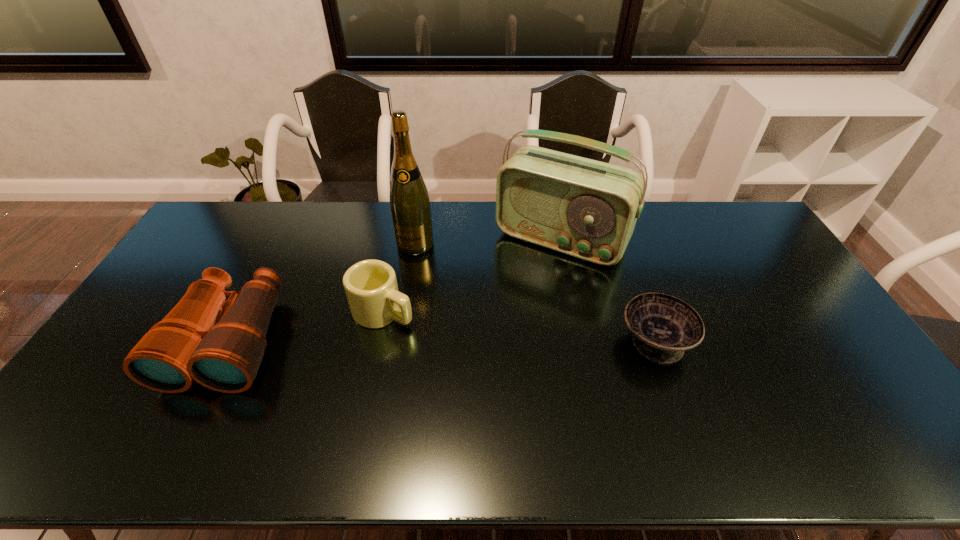
At what (x,y) coordinates should I click in order to perform the action: click on free space that is in between the mug and the wine bottle. Please return your answer as a coordinate pair (x, y). This screenshot has height=540, width=960. Looking at the image, I should click on (399, 278).

Identify the location of empty space between the tallest object and the bowl. (535, 293).

Where is `object that stands as the fourth closest to the radio receiver`? object that stands as the fourth closest to the radio receiver is located at coordinates (224, 354).

Find the location of a particular element. object that stands as the second closest to the mug is located at coordinates (410, 206).

At what (x,y) coordinates should I click in order to perform the action: click on free space that satisfies the following two spatial constraints: 1. through the lenses of the leftmost object; 2. on the right side of the bowl. Please return your answer as a coordinate pair (x, y). The width and height of the screenshot is (960, 540). Looking at the image, I should click on (229, 341).

Where is `vacant space that satisfies the following two spatial constraints: 1. through the lenses of the binoculars; 2. on the left side of the bowl`? vacant space that satisfies the following two spatial constraints: 1. through the lenses of the binoculars; 2. on the left side of the bowl is located at coordinates (229, 341).

Find the location of a particular element. The width and height of the screenshot is (960, 540). free location that satisfies the following two spatial constraints: 1. on the front side of the bowl; 2. on the left side of the fourth shortest object is located at coordinates (582, 341).